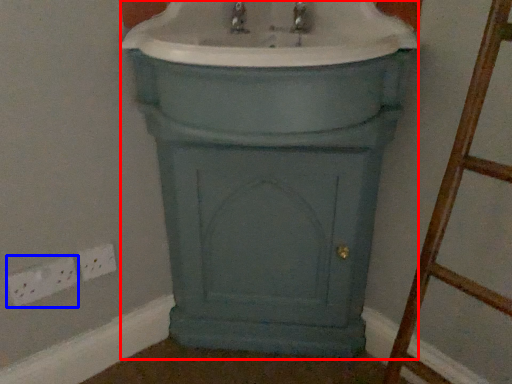
Question: Which object appears farthest to the camera in this image, porcelain (highlighted by a red box) or electric outlet (highlighted by a blue box)?

Choices:
 (A) porcelain
 (B) electric outlet

Answer: (B)